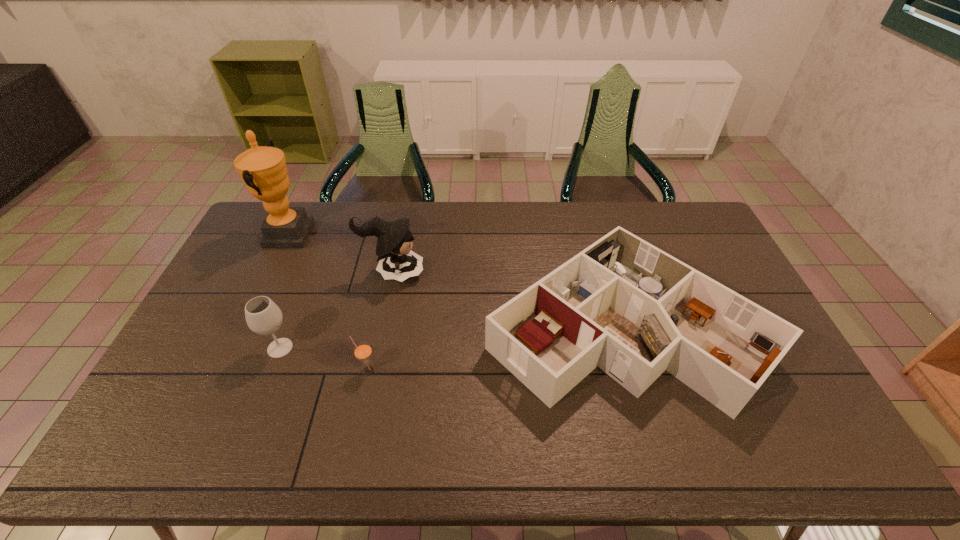
Locate an element on the screen. the farthest object is located at coordinates [x=263, y=169].

The width and height of the screenshot is (960, 540). In order to click on the leftmost object in this screenshot , I will do `click(263, 169)`.

At what (x,y) coordinates should I click in order to perform the action: click on the fourth shortest object. Please return your answer as a coordinate pair (x, y). The image size is (960, 540). Looking at the image, I should click on (396, 260).

Find the location of a particular element. The width and height of the screenshot is (960, 540). wineglass is located at coordinates coord(263,316).

You are a GUI agent. You are given a task and a screenshot of the screen. Output one action in this format:
    pyautogui.click(x=<x>, y=<y>)
    Task: Click on the second object from left to right
    
    Given the screenshot: What is the action you would take?
    click(x=263, y=316)

The height and width of the screenshot is (540, 960). Find the location of `the rightmost object`. the rightmost object is located at coordinates pyautogui.click(x=622, y=304).

Locate an element on the screen. This screenshot has width=960, height=540. straw is located at coordinates (362, 350).

In order to click on vacant space situated 0.330m at the front of the leftmost object with handles in this screenshot , I will do `click(398, 235)`.

Identify the location of free space located 0.320m at the face of the doll. The width and height of the screenshot is (960, 540). (519, 273).

Identify the location of vacant space located on the right of the third shortest object. This screenshot has width=960, height=540. (341, 348).